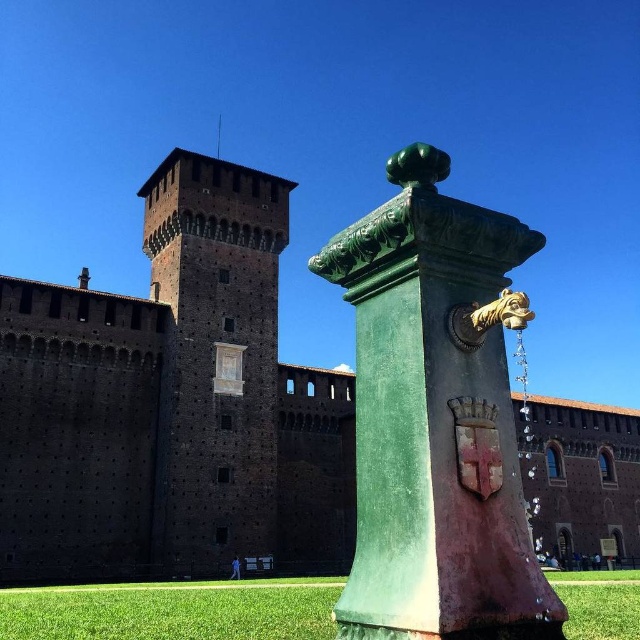
You are standing in front of the historic brick tower and want to determine which of the two points, point [168,436] or point [618,580], is nearer to you. Based on the scene, which point is closer?

Point [168,436] is closer to the viewer than point [618,580].

You are a tourist visiting a historic site and want to take a photo of the dark brown stone tower at center and the green grass at lower center. Which object should you focus on first if you want to capture both in a single frame without moving the camera?

The dark brown stone tower at center has a smaller size compared to green grass at lower center, so you should focus on the green grass at lower center first as it is larger and will occupy more of the frame, ensuring both elements are captured effectively.

You are an architect examining the scene. You notice two fountains labeled as green glazed fountain at center and green patinated metal fountain at center. Which fountain is positioned higher in the image?

The green patinated metal fountain at center is positioned higher because the green glazed fountain at center is located below it.